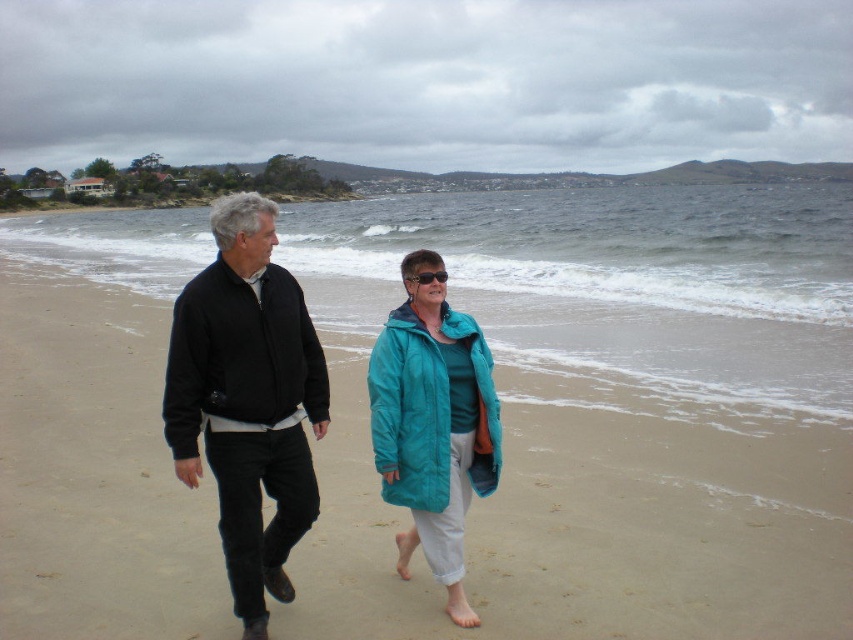
Question: Observing the image, what is the correct spatial positioning of black cotton jacket at left in reference to teal puffy coat at center?

Choices:
 (A) below
 (B) above

Answer: (B)

Question: Which of the following is the closest to the observer?

Choices:
 (A) (282, 324)
 (B) (469, 456)
 (C) (547, 540)

Answer: (A)

Question: Among these points, which one is farthest from the camera?

Choices:
 (A) (248, 508)
 (B) (403, 440)
 (C) (537, 634)

Answer: (B)

Question: Can you confirm if beige sand at center is positioned to the right of black cotton jacket at left?

Choices:
 (A) yes
 (B) no

Answer: (A)

Question: Which object appears farthest from the camera in this image?

Choices:
 (A) beige sand at center
 (B) black cotton jacket at left

Answer: (A)

Question: Does beige sand at center have a greater width compared to black cotton jacket at left?

Choices:
 (A) no
 (B) yes

Answer: (B)